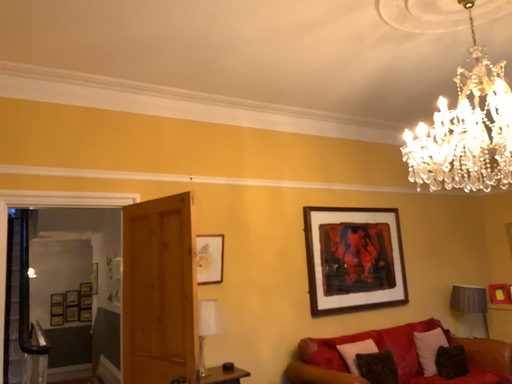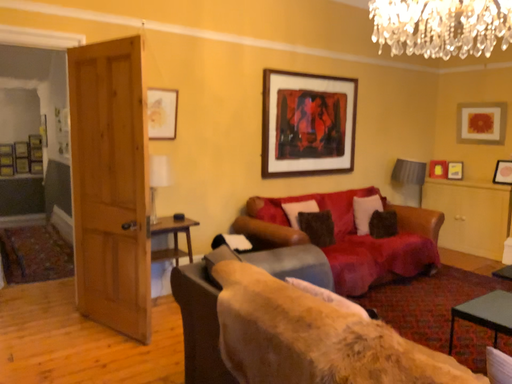
Question: Which way did the camera rotate in the video?

Choices:
 (A) rotated downward
 (B) rotated upward

Answer: (A)